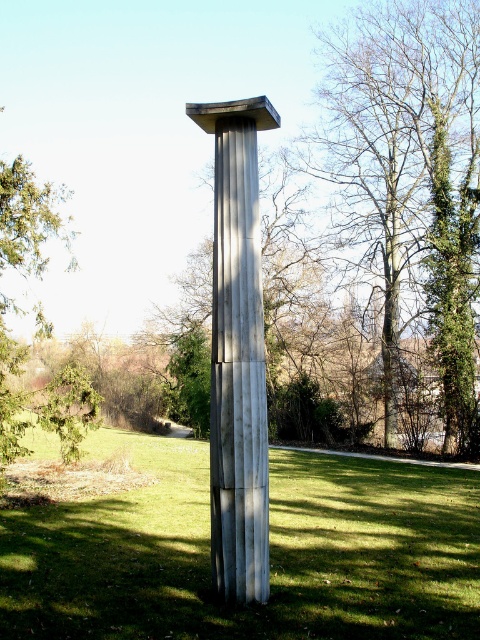
Question: Does green grass at center have a lesser width compared to green leafy tree at left?

Choices:
 (A) yes
 (B) no

Answer: (B)

Question: Considering the real-world distances, which object is closest to the green leafy tree at left?

Choices:
 (A) satin silver column at center
 (B) green leafy tree at center

Answer: (A)

Question: Which object is closer to the camera taking this photo?

Choices:
 (A) green leafy tree at center
 (B) green leafy tree at left
 (C) green grass at center

Answer: (C)

Question: Is green leafy tree at center to the left of green leafy tree at left from the viewer's perspective?

Choices:
 (A) no
 (B) yes

Answer: (A)

Question: Which of these objects is positioned farthest from the green grass at center?

Choices:
 (A) green leafy tree at center
 (B) green leafy tree at left

Answer: (A)

Question: Can you confirm if green leafy tree at center is thinner than satin silver column at center?

Choices:
 (A) yes
 (B) no

Answer: (B)